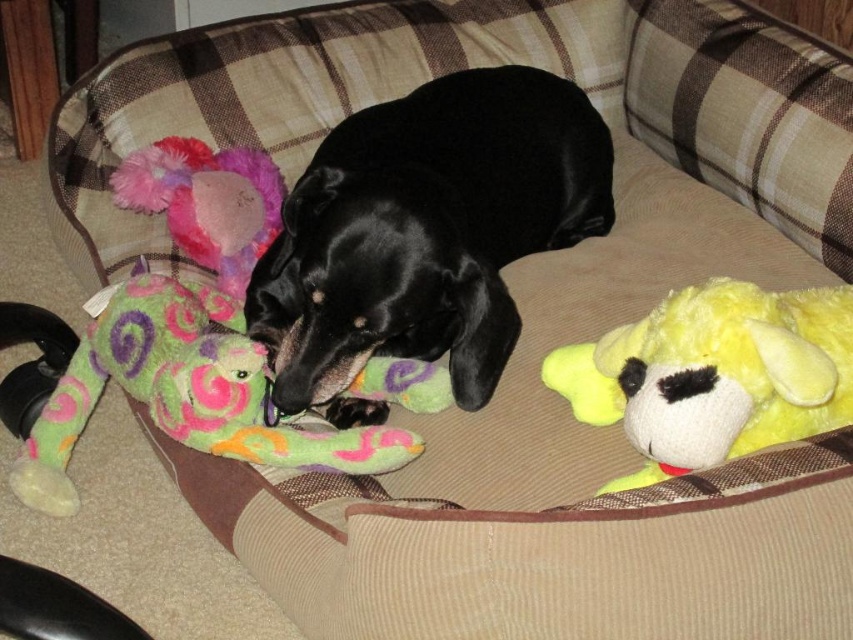
You are a toy collector who wants to place a new 12 inch tall collectible between the yellow plush dog at right and the fluffy plush toy at upper left. Can you fit it without moving either existing toys?

The yellow plush dog at right and fluffy plush toy at upper left are 28.16 inches apart. Since the new collectible is only 12 inches tall, there is enough space between them to place it without moving either existing toy.

You are a dog owner who wants to place a new toy between the yellow plush dog at right and the fluffy plush toy at upper left. Based on their positions, which toy should you move to create space?

The yellow plush dog at right is in front of the fluffy plush toy at upper left, so you should move the yellow plush dog at right to create space between them.

You are a dog owner who wants to ensure your dog has enough space to stretch out on the plaid dog bed. Given the size of the black glossy dog at center and the fluffy plush toy at upper left, which object takes up more vertical space in the scene?

The black glossy dog at center is much taller than the fluffy plush toy at upper left, so it takes up more vertical space.